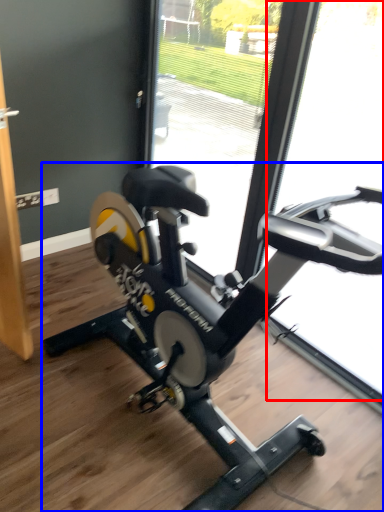
Question: Which of the following is the farthest to the observer, glass door (highlighted by a red box) or stationary bicycle (highlighted by a blue box)?

Choices:
 (A) glass door
 (B) stationary bicycle

Answer: (A)